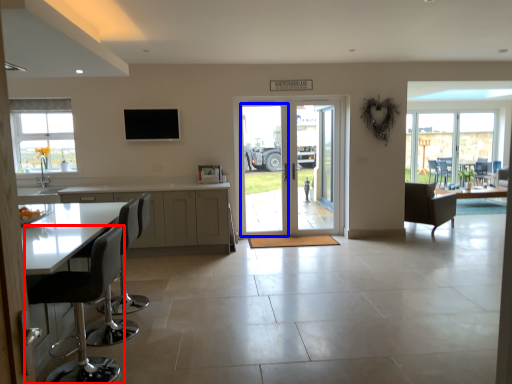
Question: Among these objects, which one is nearest to the camera, chair (highlighted by a red box) or screen door (highlighted by a blue box)?

Choices:
 (A) chair
 (B) screen door

Answer: (A)